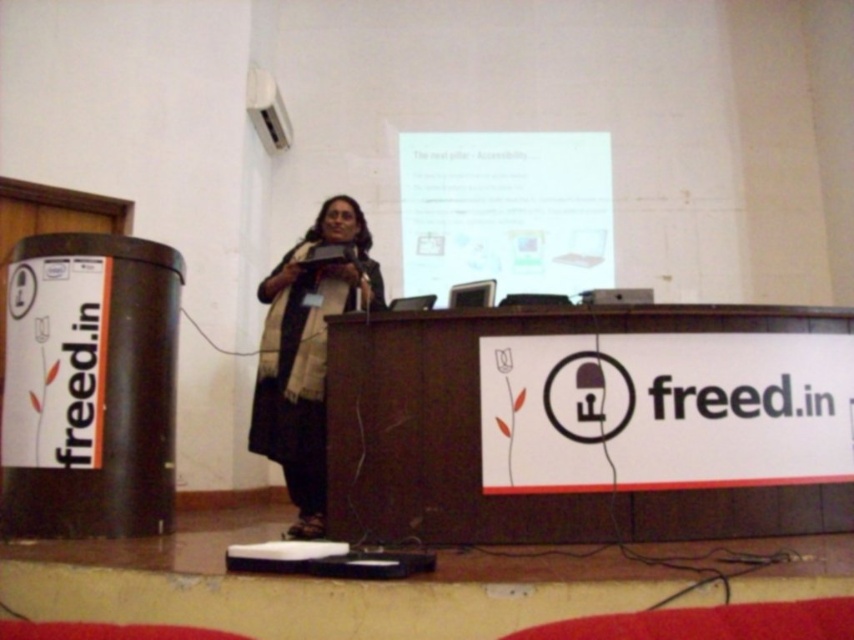
Question: Can you confirm if white glossy projector screen at upper center is bigger than dark gray scarf at center?

Choices:
 (A) yes
 (B) no

Answer: (A)

Question: Can you confirm if white glossy projector screen at upper center is bigger than dark gray scarf at center?

Choices:
 (A) yes
 (B) no

Answer: (A)

Question: Among these points, which one is nearest to the camera?

Choices:
 (A) (295, 420)
 (B) (530, 282)

Answer: (A)

Question: Can you confirm if white glossy projector screen at upper center is thinner than dark gray scarf at center?

Choices:
 (A) no
 (B) yes

Answer: (A)

Question: Which of the following is the closest to the observer?

Choices:
 (A) (320, 368)
 (B) (510, 204)

Answer: (A)